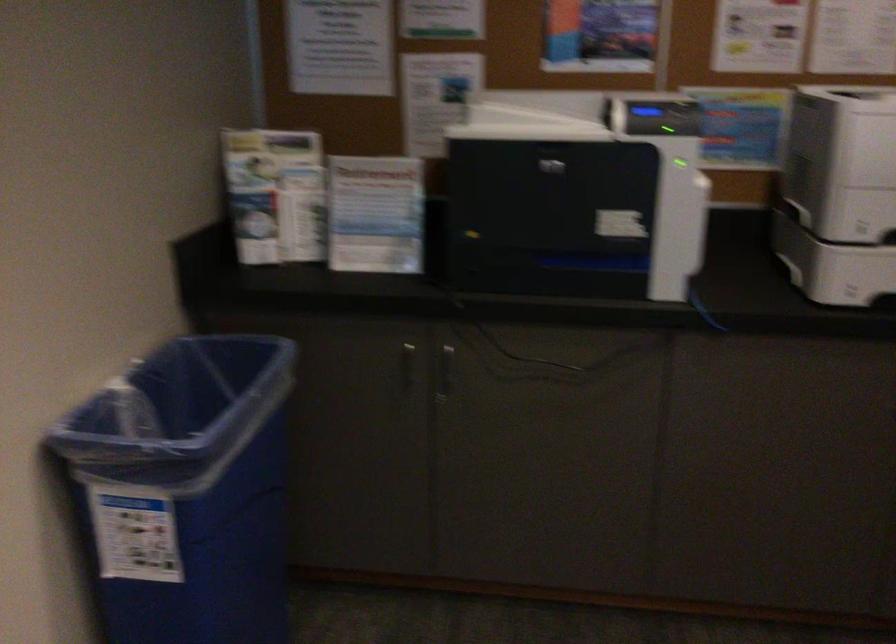
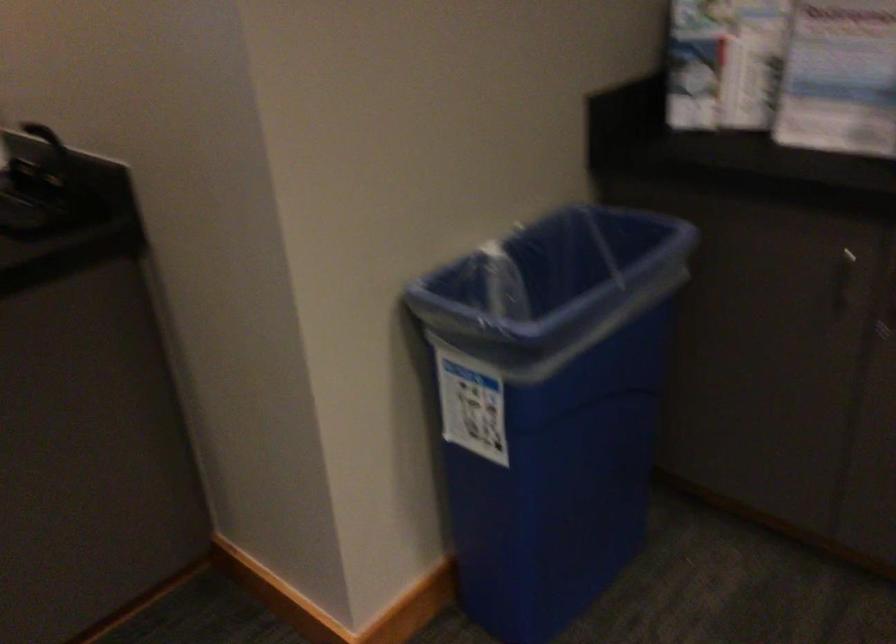
Question: The camera is either moving clockwise (left) or counter-clockwise (right) around the object. The first image is from the beginning of the video and the second image is from the end. Is the camera moving left or right when shooting the video?

Choices:
 (A) Left
 (B) Right

Answer: (B)